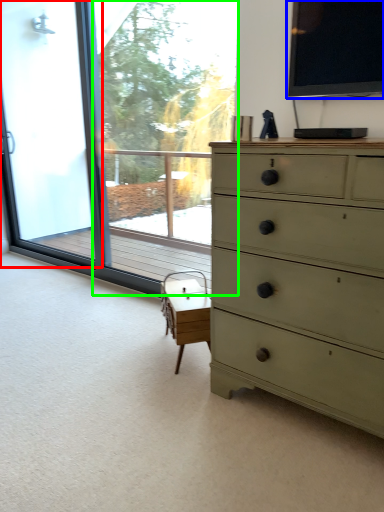
Question: Considering the real-world distances, which object is closest to screen door (highlighted by a red box)? window screen (highlighted by a blue box) or window screen (highlighted by a green box).

Choices:
 (A) window screen
 (B) window screen

Answer: (B)